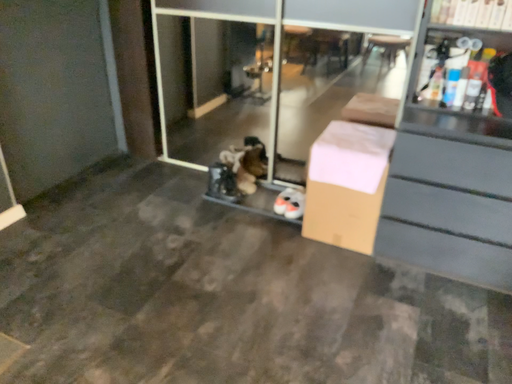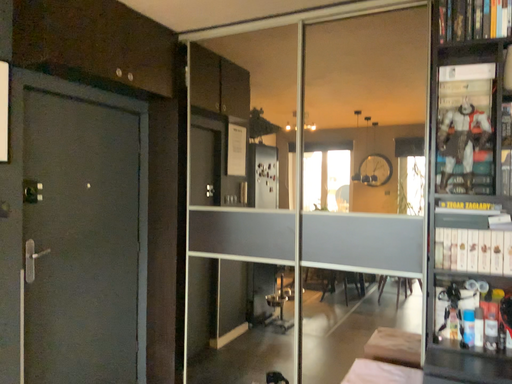
Question: How did the camera likely rotate when shooting the video?

Choices:
 (A) rotated upward
 (B) rotated downward

Answer: (A)